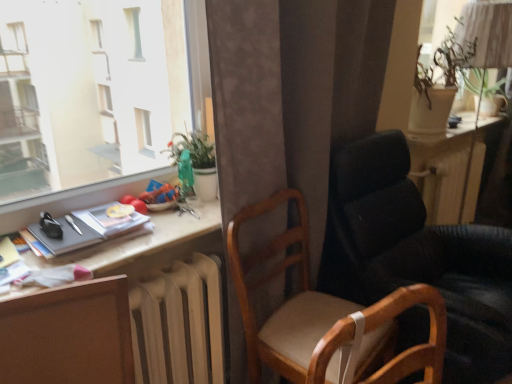
This screenshot has height=384, width=512. What are the coordinates of `white matte radiator at lower center` in the screenshot? It's located at (179, 325).

Measure the distance between point (92, 163) and camera.

Point (92, 163) is 2.70 meters away from camera.

Image resolution: width=512 pixels, height=384 pixels. What do you see at coordinates (95, 88) in the screenshot?
I see `matte white window sill at lower left` at bounding box center [95, 88].

Image resolution: width=512 pixels, height=384 pixels. Describe the element at coordinates (419, 255) in the screenshot. I see `leather-like black chair at right, arranged as the 2th chair when viewed from the left` at that location.

The height and width of the screenshot is (384, 512). What are the coordinates of `white matte radiator at lower center` in the screenshot? It's located at (179, 325).

Is green matte plant at upper right, placed as the 1th houseplant when sorted from top to bottom, facing away from green glossy plant at upper center, marked as the first houseplant in a left-to-right arrangement?

That's not correct — green matte plant at upper right, placed as the 1th houseplant when sorted from top to bottom, is not looking away from green glossy plant at upper center, marked as the first houseplant in a left-to-right arrangement.

In terms of size, does green matte plant at upper right, placed as the 1th houseplant when sorted from top to bottom, appear bigger or smaller than green glossy plant at upper center, the second houseplant from the top?

Considering their sizes, green matte plant at upper right, placed as the 1th houseplant when sorted from top to bottom, takes up more space than green glossy plant at upper center, the second houseplant from the top.

Which object is further away from the camera taking this photo, green matte plant at upper right, placed as the 1th houseplant when sorted from top to bottom, or green glossy plant at upper center, the second houseplant from the top?

green matte plant at upper right, placed as the 1th houseplant when sorted from top to bottom, is more distant.

From a real-world perspective, who is located lower, green matte plant at upper right, which appears as the 1th houseplant when viewed from the back, or green glossy plant at upper center, marked as the first houseplant in a left-to-right arrangement?

In real-world perspective, green glossy plant at upper center, marked as the first houseplant in a left-to-right arrangement, is lower.

From a real-world perspective, does matte black book at left sit lower than wooden chair at center, which is the first chair in left-to-right order?

Incorrect, from a real-world perspective, matte black book at left is higher than wooden chair at center, which is the first chair in left-to-right order.

Could you tell me if matte black book at left is facing wooden chair at center, which is the first chair in left-to-right order?

No, matte black book at left is not aimed at wooden chair at center, which is the first chair in left-to-right order.

Is point (49, 244) behind point (417, 353)?

Yes, point (49, 244) is farther from viewer.

Does green glossy plant at upper center, the second houseplant from the back, have a larger size compared to matte white window sill at lower left?

No.

In the scene shown: Are green glossy plant at upper center, which is counted as the 1th houseplant, starting from the bottom, and matte white window sill at lower left located far from each other?

green glossy plant at upper center, which is counted as the 1th houseplant, starting from the bottom, is near matte white window sill at lower left, not far away.

From the picture: Measure the distance between green glossy plant at upper center, the second houseplant from the back, and matte white window sill at lower left.

green glossy plant at upper center, the second houseplant from the back, and matte white window sill at lower left are 19.45 inches apart.

Which is in front, green glossy plant at upper center, which is counted as the 1th houseplant, starting from the bottom, or matte white window sill at lower left?

matte white window sill at lower left.

Considering the relative sizes of beige fabric swivel chair at center and wooden table at right, which appears as the 2th table when viewed from the front, in the image provided, is beige fabric swivel chair at center taller than wooden table at right, which appears as the 2th table when viewed from the front,?

In fact, beige fabric swivel chair at center may be shorter than wooden table at right, which appears as the 2th table when viewed from the front.

Does beige fabric swivel chair at center have a larger size compared to wooden table at right, positioned as the 2th table in left-to-right order?

Incorrect, beige fabric swivel chair at center is not larger than wooden table at right, positioned as the 2th table in left-to-right order.

Is beige fabric swivel chair at center to the right of wooden table at right, positioned as the 2th table in left-to-right order, from the viewer's perspective?

No.

Does green matte plant at upper right, the second houseplant positioned from the front, touch beige fabric swivel chair at center?

green matte plant at upper right, the second houseplant positioned from the front, and beige fabric swivel chair at center are not in contact.

Between green matte plant at upper right, which appears as the 1th houseplant when viewed from the back, and beige fabric swivel chair at center, which one is positioned behind?

green matte plant at upper right, which appears as the 1th houseplant when viewed from the back, is behind.

Is green matte plant at upper right, which is counted as the 2th houseplant, starting from the bottom, aimed at beige fabric swivel chair at center?

No.

From the beige fabric swivel chair at center, count 1st houseplants backward and point to it. Please provide its 2D coordinates.

[(195, 163)]

In the image, is green glossy plant at upper center, marked as the first houseplant in a left-to-right arrangement, on the left side or the right side of beige fabric swivel chair at center?

Clearly, green glossy plant at upper center, marked as the first houseplant in a left-to-right arrangement, is on the left of beige fabric swivel chair at center in the image.

Which object is further away from the camera taking this photo, green glossy plant at upper center, the second houseplant from the top, or beige fabric swivel chair at center?

green glossy plant at upper center, the second houseplant from the top, is behind.

Looking at this image, is green glossy plant at upper center, the second houseplant from the back, bigger or smaller than beige fabric swivel chair at center?

green glossy plant at upper center, the second houseplant from the back, is smaller than beige fabric swivel chair at center.

Is matte black table lamp at upper right oriented towards brown wood desk at lower left?

No, matte black table lamp at upper right is not facing towards brown wood desk at lower left.

Is matte black table lamp at upper right not close to brown wood desk at lower left?

Yes.

From a real-world perspective, which object stands above the other?

brown wood desk at lower left is physically above.

Where is `houseplant to the left of green matte plant at upper right, which is counted as the 2th houseplant, starting from the bottom`? houseplant to the left of green matte plant at upper right, which is counted as the 2th houseplant, starting from the bottom is located at coordinates (195, 163).

Identify the location of book above the wooden chair at center, which is the first chair in left-to-right order (from the image's perspective). (89, 229).

Based on their spatial positions, is beige fabric swivel chair at center or wooden table at right, acting as the 1th table starting from the back, closer to white matte radiator at lower center?

beige fabric swivel chair at center is positioned closer to the anchor white matte radiator at lower center.

Estimate the real-world distances between objects in this image. Which object is closer to green matte plant at upper right, the 2th houseplant positioned from the left, matte white window sill at lower left or beige fabric swivel chair at center?

The object closer to green matte plant at upper right, the 2th houseplant positioned from the left, is matte white window sill at lower left.

Based on their spatial positions, is wooden chair at center, the 2th chair positioned from the right, or wooden table at lower left, the 1th table when ordered from front to back, closer to beige fabric swivel chair at center?

wooden chair at center, the 2th chair positioned from the right, lies closer to beige fabric swivel chair at center than the other object.

From the image, which object appears to be farther from green matte plant at upper right, the 2th houseplant positioned from the left, matte black table lamp at upper right or matte white window sill at lower left?

Among the two, matte white window sill at lower left is located further to green matte plant at upper right, the 2th houseplant positioned from the left.

In the scene shown: Estimate the real-world distances between objects in this image. Which object is closer to matte black book at left, green glossy plant at upper center, which is the 1th houseplant in front-to-back order, or green matte plant at upper right, which appears as the 1th houseplant when viewed from the back?

green glossy plant at upper center, which is the 1th houseplant in front-to-back order, is positioned closer to the anchor matte black book at left.

Looking at the image, which one is located further to wooden table at right, marked as the first table in a right-to-left arrangement, green matte plant at upper right, the 1th houseplant when ordered from right to left, or matte black table lamp at upper right?

Among the two, matte black table lamp at upper right is located further to wooden table at right, marked as the first table in a right-to-left arrangement.

Based on their spatial positions, is wooden table at right, which appears as the 2th table when viewed from the front, or wooden chair at center, which is the first chair in left-to-right order, closer to wooden table at lower left, positioned as the 2th table in right-to-left order?

wooden chair at center, which is the first chair in left-to-right order, is closer to wooden table at lower left, positioned as the 2th table in right-to-left order.

Estimate the real-world distances between objects in this image. Which object is closer to wooden chair at center, the 2th chair positioned from the right, wooden table at lower left, the 2th table viewed from the back, or wooden table at right, acting as the 1th table starting from the back?

wooden table at lower left, the 2th table viewed from the back, is closer to wooden chair at center, the 2th chair positioned from the right.

Find the location of `houseplant situated between wooden table at lower left, which appears as the first table when viewed from the left, and wooden chair at center, which is the first chair in left-to-right order, from left to right`. houseplant situated between wooden table at lower left, which appears as the first table when viewed from the left, and wooden chair at center, which is the first chair in left-to-right order, from left to right is located at coordinates (195, 163).

The height and width of the screenshot is (384, 512). Find the location of `houseplant between matte white window sill at lower left and green matte plant at upper right, the second houseplant positioned from the front, in the horizontal direction`. houseplant between matte white window sill at lower left and green matte plant at upper right, the second houseplant positioned from the front, in the horizontal direction is located at coordinates (195, 163).

The height and width of the screenshot is (384, 512). Find the location of `chair between matte white window sill at lower left and leather-like black chair at right, which is the 1th chair from right to left, from left to right`. chair between matte white window sill at lower left and leather-like black chair at right, which is the 1th chair from right to left, from left to right is located at coordinates (324, 315).

The width and height of the screenshot is (512, 384). I want to click on houseplant between green glossy plant at upper center, which is counted as the 1th houseplant, starting from the bottom, and wooden table at right, positioned as the 2th table in left-to-right order, from left to right, so click(x=437, y=88).